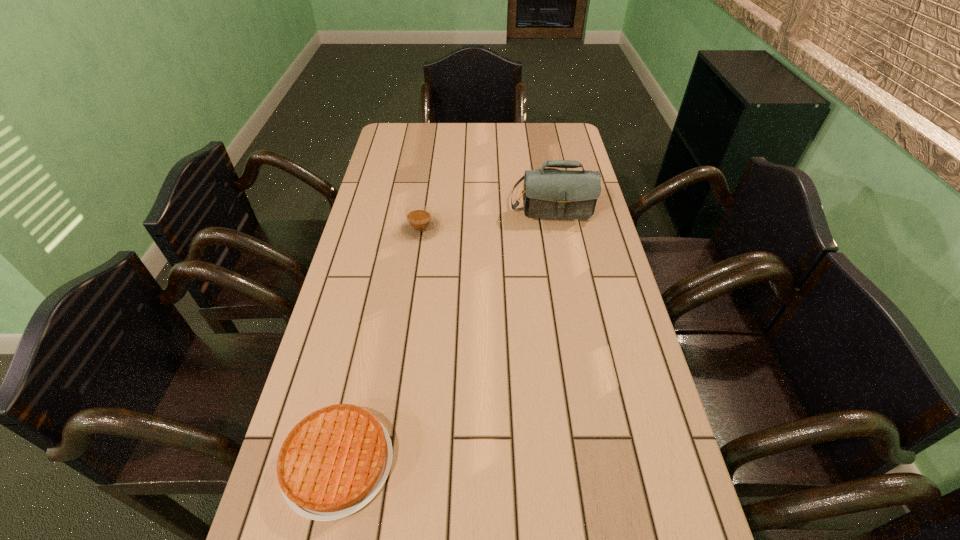
At what (x,y) coordinates should I click in order to perform the action: click on the tallest object. Please return your answer as a coordinate pair (x, y). This screenshot has width=960, height=540. Looking at the image, I should click on (549, 193).

This screenshot has width=960, height=540. Find the location of `the rightmost object`. the rightmost object is located at coordinates (549, 193).

Where is `cappuccino`? The height and width of the screenshot is (540, 960). cappuccino is located at coordinates (419, 224).

Locate an element on the screen. This screenshot has height=540, width=960. pie is located at coordinates (x=334, y=461).

Locate an element on the screen. This screenshot has height=540, width=960. the shortest object is located at coordinates (334, 461).

Where is `free space located 0.220m on the front of the rightmost object`? Image resolution: width=960 pixels, height=540 pixels. free space located 0.220m on the front of the rightmost object is located at coordinates click(x=566, y=280).

In order to click on free location located on the left of the second shortest object in this screenshot , I will do `click(357, 230)`.

Find the location of a particular element. Image resolution: width=960 pixels, height=540 pixels. vacant space located on the back of the nearest object is located at coordinates (379, 276).

This screenshot has height=540, width=960. In order to click on cappuccino that is at the left edge in this screenshot , I will do `click(419, 224)`.

The width and height of the screenshot is (960, 540). I want to click on pie present at the left edge, so click(334, 461).